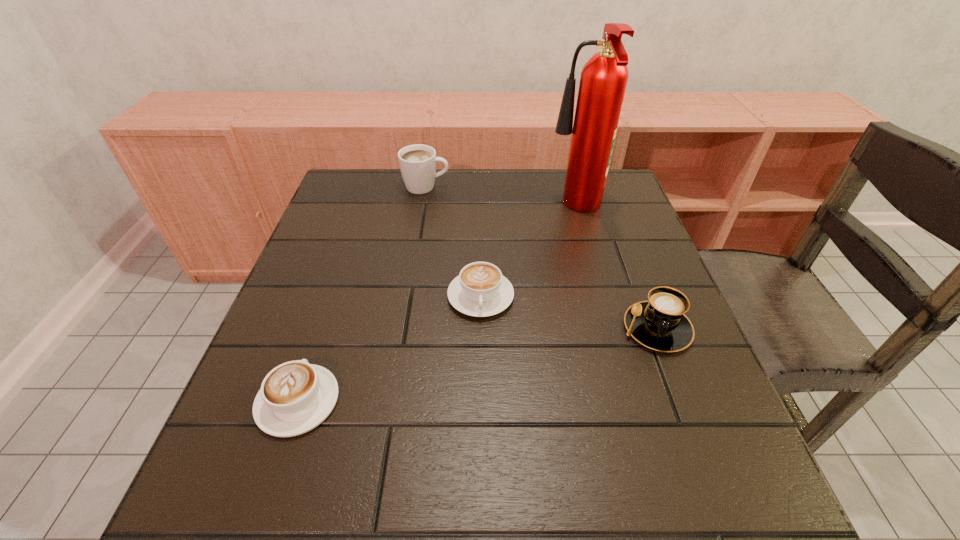
This screenshot has height=540, width=960. Identify the location of fire extinguisher present at the right edge. (603, 80).

At what (x,y) coordinates should I click in order to perform the action: click on cappuccino that is at the right edge. Please return your answer as a coordinate pair (x, y). The image size is (960, 540). Looking at the image, I should click on (660, 323).

This screenshot has width=960, height=540. Identify the location of object present at the far right corner. (603, 80).

Where is `vacant region at the far edge of the desktop`? vacant region at the far edge of the desktop is located at coordinates (x=521, y=200).

You are a GUI agent. You are given a task and a screenshot of the screen. Output one action in this format:
    pyautogui.click(x=<x>, y=<y>)
    Task: Click on the free space at the near edge
    
    Given the screenshot: What is the action you would take?
    pyautogui.click(x=309, y=520)

The height and width of the screenshot is (540, 960). In the image, there is a desktop. What are the coordinates of `vacant area at the left edge` in the screenshot? It's located at (292, 346).

At what (x,y) coordinates should I click in order to perform the action: click on free space at the right edge of the desktop. Please return your answer as a coordinate pair (x, y). Image resolution: width=960 pixels, height=540 pixels. Looking at the image, I should click on (660, 396).

You are a GUI agent. You are given a task and a screenshot of the screen. Output one action in this format:
    pyautogui.click(x=<x>, y=<y>)
    Task: Click on the vacant region at the near right corner
    The height and width of the screenshot is (540, 960).
    Given the screenshot: What is the action you would take?
    pyautogui.click(x=719, y=481)

You are a GUI agent. You are given a task and a screenshot of the screen. Output one action in this format:
    pyautogui.click(x=<x>, y=<y>)
    Task: Click on the free space between the second tallest cappuccino and the second cappuccino from right to left
    
    Given the screenshot: What is the action you would take?
    pos(568,312)

The width and height of the screenshot is (960, 540). I want to click on vacant area between the second tallest cappuccino and the third object from right to left, so pos(568,312).